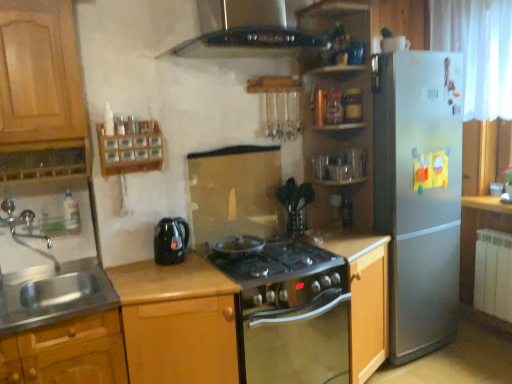
Question: Is black glass exhaust hood at upper center looking in the opposite direction of silver metallic refrigerator at right?

Choices:
 (A) no
 (B) yes

Answer: (A)

Question: Can you confirm if black glass exhaust hood at upper center is positioned to the right of silver metallic refrigerator at right?

Choices:
 (A) yes
 (B) no

Answer: (B)

Question: Is black glass exhaust hood at upper center thinner than silver metallic refrigerator at right?

Choices:
 (A) no
 (B) yes

Answer: (B)

Question: From the image's perspective, is black glass exhaust hood at upper center under silver metallic refrigerator at right?

Choices:
 (A) yes
 (B) no

Answer: (B)

Question: Does black glass exhaust hood at upper center have a greater width compared to silver metallic refrigerator at right?

Choices:
 (A) yes
 (B) no

Answer: (B)

Question: Is metallic oak cabinet at lower left, placed as the first cabinetry when sorted from left to right, wider or thinner than black glass stove at center?

Choices:
 (A) wide
 (B) thin

Answer: (B)

Question: From a real-world perspective, is metallic oak cabinet at lower left, placed as the first cabinetry when sorted from left to right, physically located above or below black glass stove at center?

Choices:
 (A) below
 (B) above

Answer: (B)

Question: Is metallic oak cabinet at lower left, which is the 3th cabinetry in right-to-left order, situated inside black glass stove at center or outside?

Choices:
 (A) inside
 (B) outside

Answer: (B)

Question: From the image's perspective, relative to black glass stove at center, is metallic oak cabinet at lower left, placed as the first cabinetry when sorted from left to right, above or below?

Choices:
 (A) above
 (B) below

Answer: (B)

Question: Considering the positions of point (265, 19) and point (367, 360), is point (265, 19) closer or farther from the camera than point (367, 360)?

Choices:
 (A) closer
 (B) farther

Answer: (A)

Question: In terms of height, does black glass exhaust hood at upper center look taller or shorter compared to wooden cabinet at center, the first cabinetry when ordered from right to left?

Choices:
 (A) short
 (B) tall

Answer: (A)

Question: Considering the positions of black glass exhaust hood at upper center and wooden cabinet at center, the first cabinetry when ordered from right to left, in the image, is black glass exhaust hood at upper center wider or thinner than wooden cabinet at center, the first cabinetry when ordered from right to left,?

Choices:
 (A) wide
 (B) thin

Answer: (B)

Question: Considering the relative positions of black glass exhaust hood at upper center and wooden cabinet at center, the first cabinetry when ordered from right to left, in the image provided, is black glass exhaust hood at upper center to the left or to the right of wooden cabinet at center, the first cabinetry when ordered from right to left,?

Choices:
 (A) right
 (B) left

Answer: (B)

Question: From a real-world perspective, is black glass exhaust hood at upper center above or below stainless steel sink at lower left?

Choices:
 (A) below
 (B) above

Answer: (B)

Question: Is black glass exhaust hood at upper center bigger or smaller than stainless steel sink at lower left?

Choices:
 (A) small
 (B) big

Answer: (B)